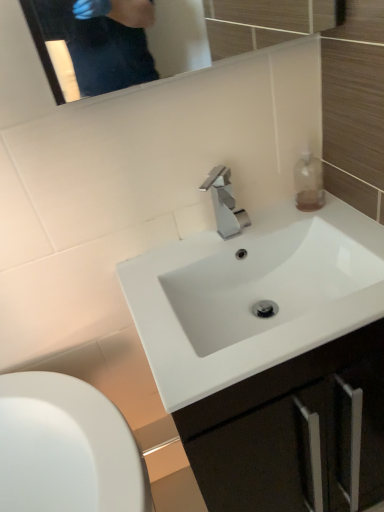
Where is `free point above white glossy sink at center, the first sink when ordered from bottom to top (from a real-world perspective)`? The height and width of the screenshot is (512, 384). free point above white glossy sink at center, the first sink when ordered from bottom to top (from a real-world perspective) is located at coordinates (236, 245).